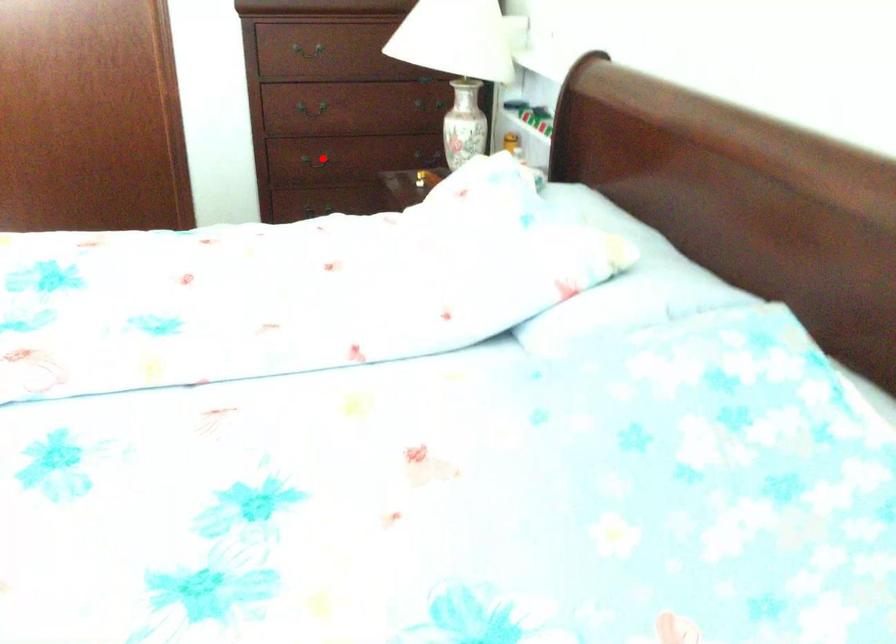
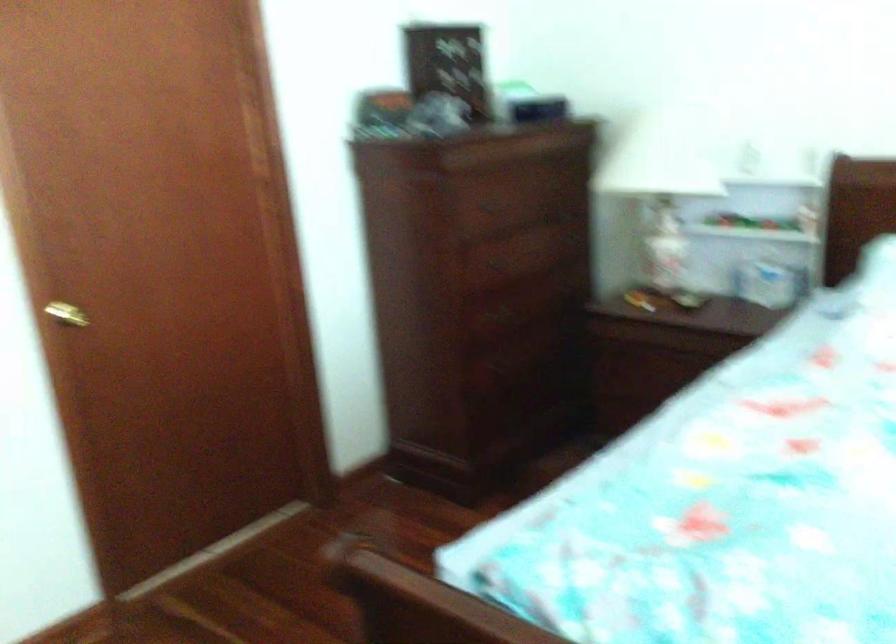
Question: I am providing you with two images of the same scene from different viewpoints. A red point is marked on the first image. Is the red point's position out of view in image 2?

Choices:
 (A) Yes
 (B) No

Answer: (A)